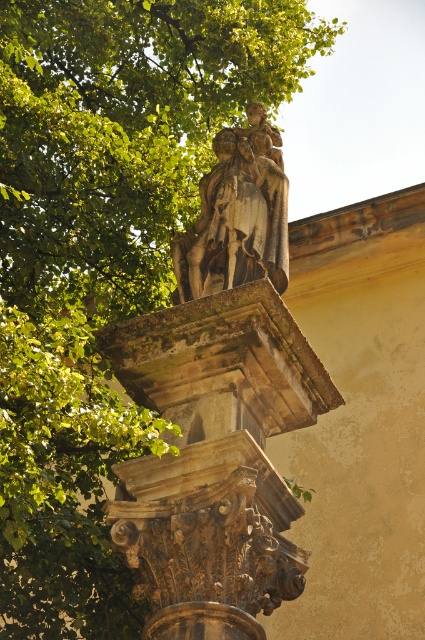
Question: Is the position of carved stone column at center less distant than that of polished bronze statue at center?

Choices:
 (A) yes
 (B) no

Answer: (A)

Question: Observing the image, what is the correct spatial positioning of carved stone column at center in reference to polished bronze statue at center?

Choices:
 (A) right
 (B) left

Answer: (A)

Question: Among these objects, which one is farthest from the camera?

Choices:
 (A) carved stone column at center
 (B) polished bronze statue at center

Answer: (B)

Question: Is carved stone column at center bigger than polished bronze statue at center?

Choices:
 (A) yes
 (B) no

Answer: (B)